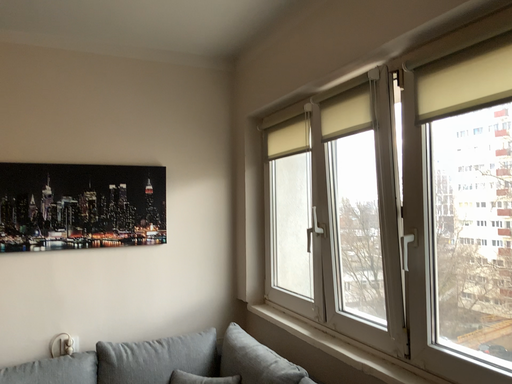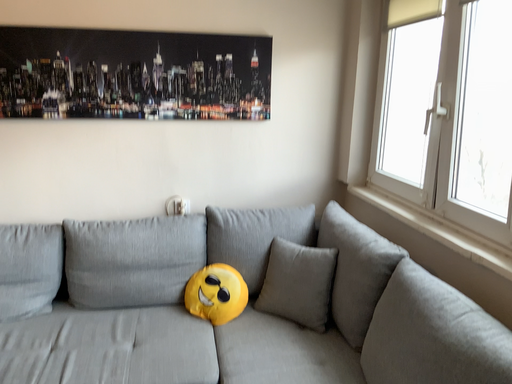
Question: How did the camera likely rotate when shooting the video?

Choices:
 (A) rotated downward
 (B) rotated upward

Answer: (A)